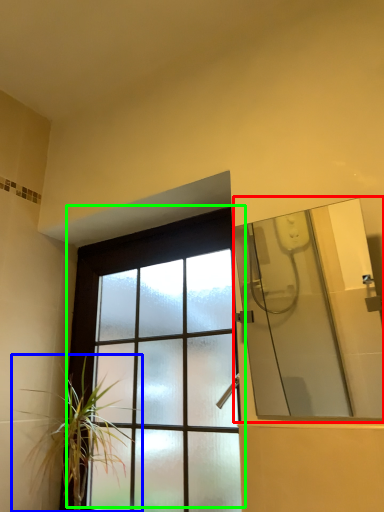
Question: Based on their relative distances, which object is nearer to mirror (highlighted by a red box)? Choose from houseplant (highlighted by a blue box) and window (highlighted by a green box).

Choices:
 (A) houseplant
 (B) window

Answer: (B)